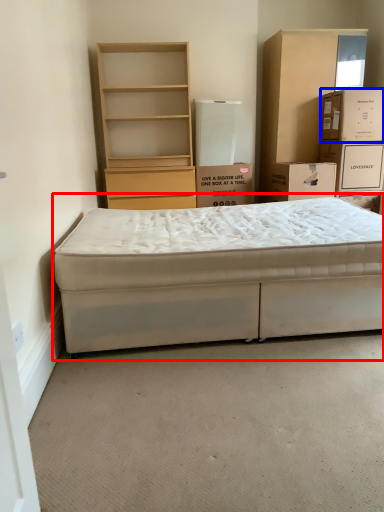
Question: Which point is further to the camera, bed (highlighted by a red box) or box (highlighted by a blue box)?

Choices:
 (A) bed
 (B) box

Answer: (B)